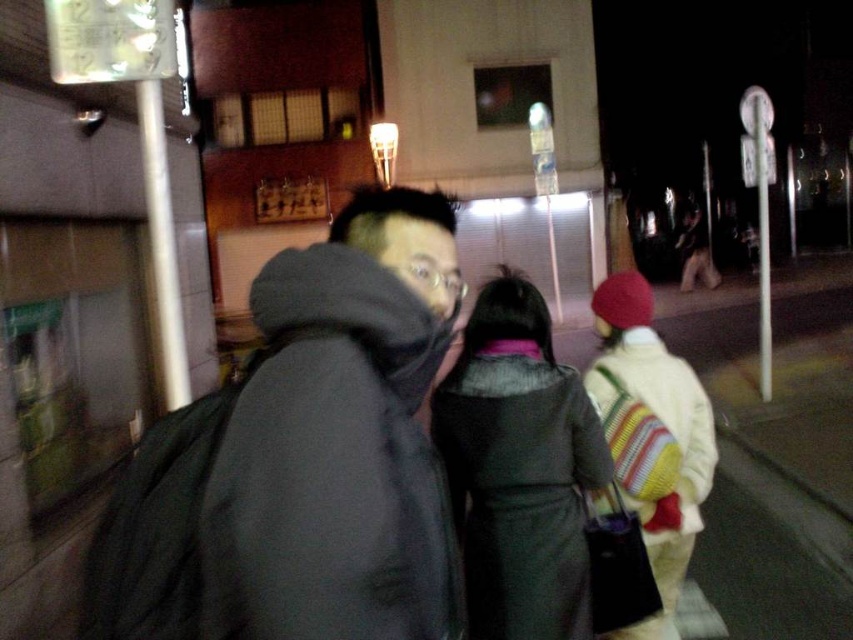
Can you confirm if dark gray hooded jacket at center is shorter than dark gray wool coat at center?

Yes.

Between dark gray hooded jacket at center and dark gray wool coat at center, which one appears on the right side from the viewer's perspective?

dark gray wool coat at center

Measure the distance between point [370,577] and camera.

35.99 inches

You are a GUI agent. You are given a task and a screenshot of the screen. Output one action in this format:
    pyautogui.click(x=<x>, y=<y>)
    Task: Click on the dark gray hooded jacket at center
    
    Given the screenshot: What is the action you would take?
    pyautogui.click(x=341, y=440)